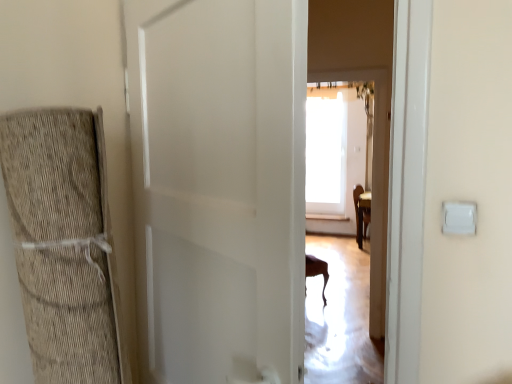
Question: Is white matte door at center spatially inside white plastic light switch at right, or outside of it?

Choices:
 (A) inside
 (B) outside

Answer: (B)

Question: From a real-world perspective, is white matte door at center physically located above or below white plastic light switch at right?

Choices:
 (A) above
 (B) below

Answer: (B)

Question: Does point coord(132,29) appear closer or farther from the camera than point coord(443,206)?

Choices:
 (A) closer
 (B) farther

Answer: (B)

Question: Would you say white plastic light switch at right is to the left or to the right of white matte door at center in the picture?

Choices:
 (A) left
 (B) right

Answer: (B)

Question: Is white plastic light switch at right bigger or smaller than white matte door at center?

Choices:
 (A) big
 (B) small

Answer: (B)

Question: Looking at their shapes, would you say white plastic light switch at right is wider or thinner than white matte door at center?

Choices:
 (A) thin
 (B) wide

Answer: (A)

Question: Considering their positions, is white plastic light switch at right located in front of or behind white matte door at center?

Choices:
 (A) behind
 (B) front

Answer: (A)